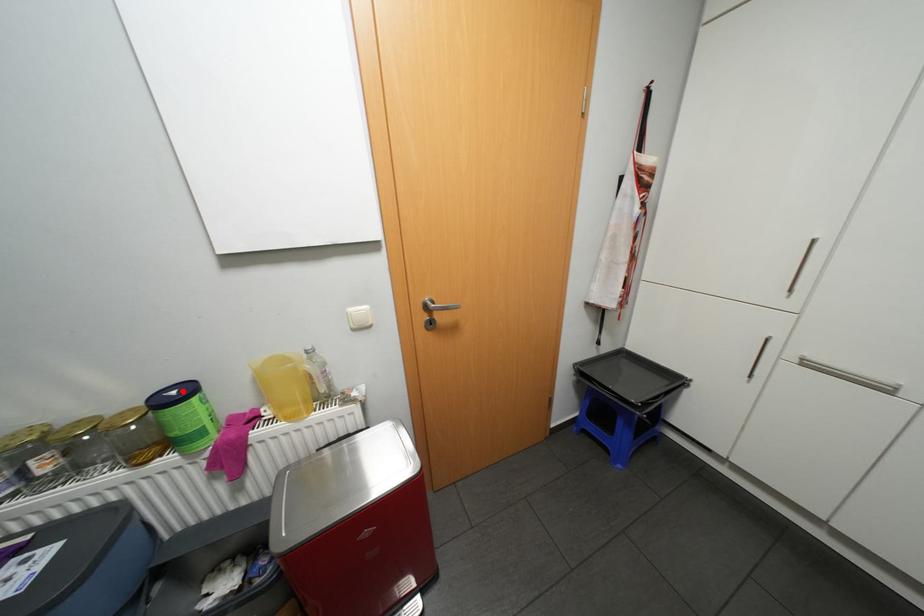
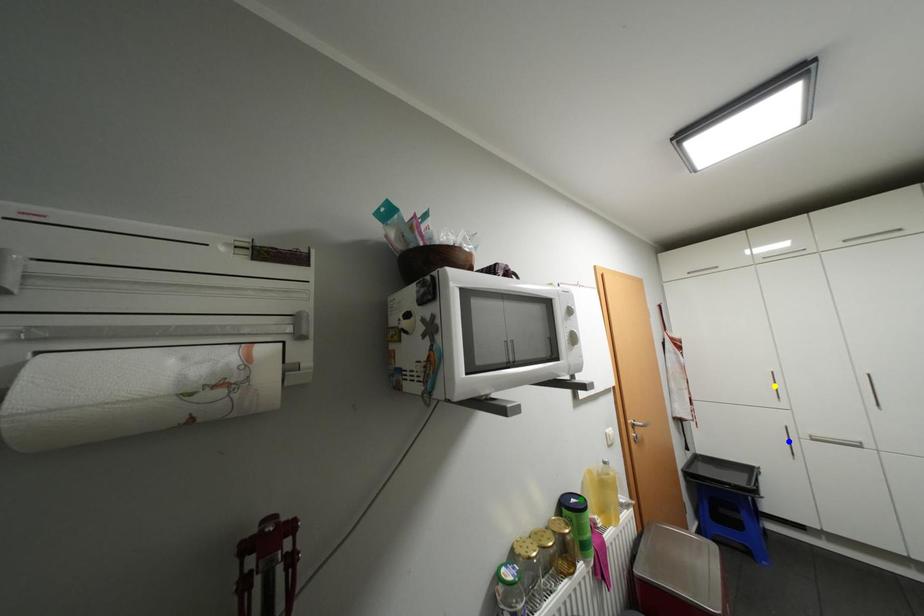
Question: I am providing you with two images of the same scene from different viewpoints. A red point is marked on the first image. You are given multiple points on the second image. Which mark in image 2 goes with the point in image 1?

Choices:
 (A) green point
 (B) blue point
 (C) yellow point

Answer: (A)